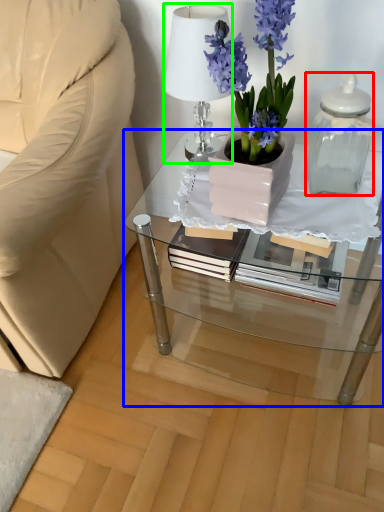
Question: Considering the real-world distances, which object is closest to bottle (highlighted by a red box)? table (highlighted by a blue box) or lamp (highlighted by a green box).

Choices:
 (A) table
 (B) lamp

Answer: (A)